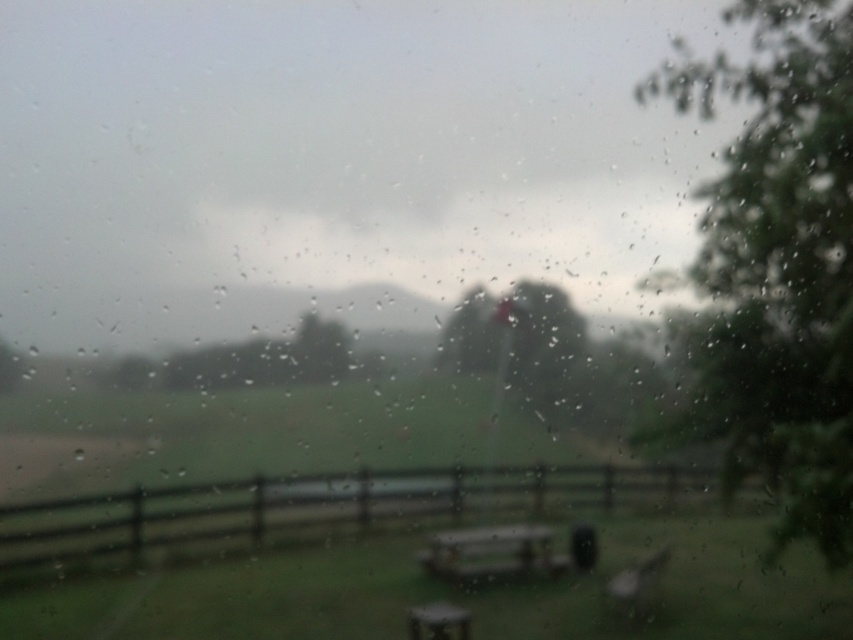
Who is positioned more to the left, brown wooden fence at lower center or green matte tree at center?

From the viewer's perspective, green matte tree at center appears more on the left side.

Which is behind, point (387, 496) or point (306, 330)?

The point (387, 496) is behind.

This screenshot has width=853, height=640. In order to click on brown wooden fence at lower center in this screenshot , I will do `click(323, 506)`.

Does brown wooden fence at lower center have a greater width compared to wooden picnic table at center?

Correct, the width of brown wooden fence at lower center exceeds that of wooden picnic table at center.

Where is `brown wooden fence at lower center`? Image resolution: width=853 pixels, height=640 pixels. brown wooden fence at lower center is located at coordinates (323, 506).

Which is in front, point (816, 188) or point (531, 564)?

Point (816, 188) is in front.

Is green leafy tree at right positioned behind wooden picnic table at center?

No, green leafy tree at right is in front of wooden picnic table at center.

Between point (735, 301) and point (495, 564), which one is positioned behind?

The point (735, 301) is behind.

The height and width of the screenshot is (640, 853). I want to click on green leafy tree at right, so click(779, 266).